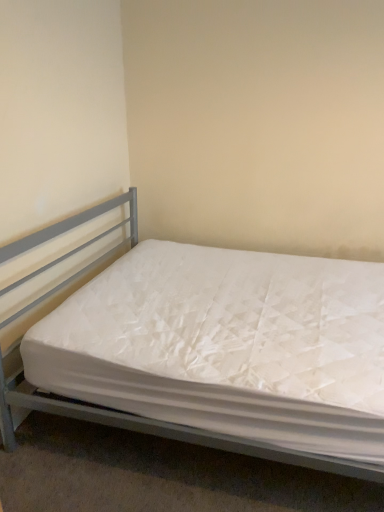
You are a GUI agent. You are given a task and a screenshot of the screen. Output one action in this format:
    pyautogui.click(x=<x>, y=<y>)
    Task: Click on the white quilted mattress at center
    
    Given the screenshot: What is the action you would take?
    pyautogui.click(x=155, y=428)

What do you see at coordinates (155, 428) in the screenshot? I see `white quilted mattress at center` at bounding box center [155, 428].

Where is `white quilted mattress at center`? This screenshot has width=384, height=512. white quilted mattress at center is located at coordinates point(155,428).